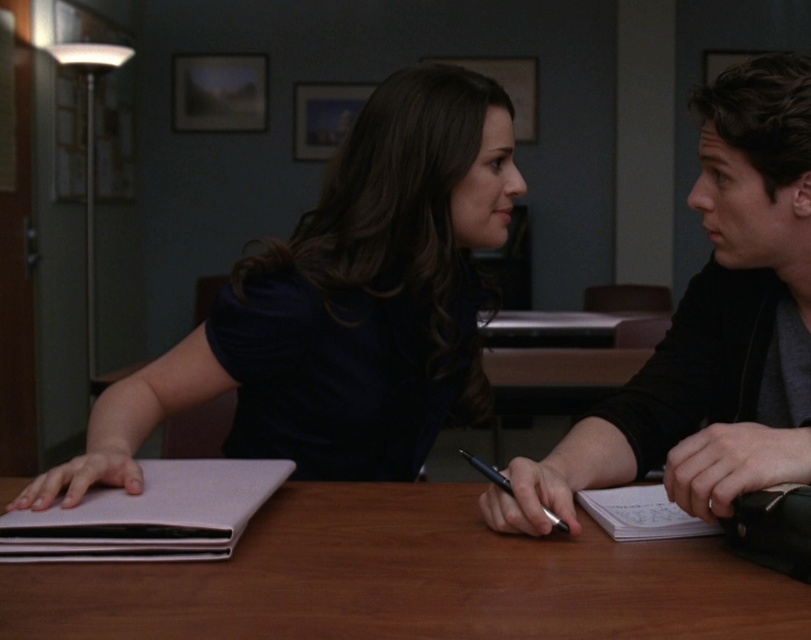
You are a photographer standing in front of the office scene. You want to take a photo focusing on the point closer to you. Which of the two points, point [421,592] or point [491,472], should you aim your camera at?

Point [421,592] is closer to the viewer than point [491,472], so you should aim your camera at point [421,592] to focus on the closer point.

You are a delivery person who needs to place a matte black laptop at center on a table that is 1.5 meters long. The table has a coordinate system where the bottom left corner is at point 0,0 and the top right corner is at point 1,1. The delivery person wants to place the laptop exactly at point (342, 305). Is this coordinate within the table?

The matte black laptop at center is located at point (342, 305), which is within the table since the coordinates are between 0 and 1.

You are standing in the office scene described. There is a point marked at coordinates (408, 579). What object is located at that point?

The point at coordinates (408, 579) marks the wooden table at center.